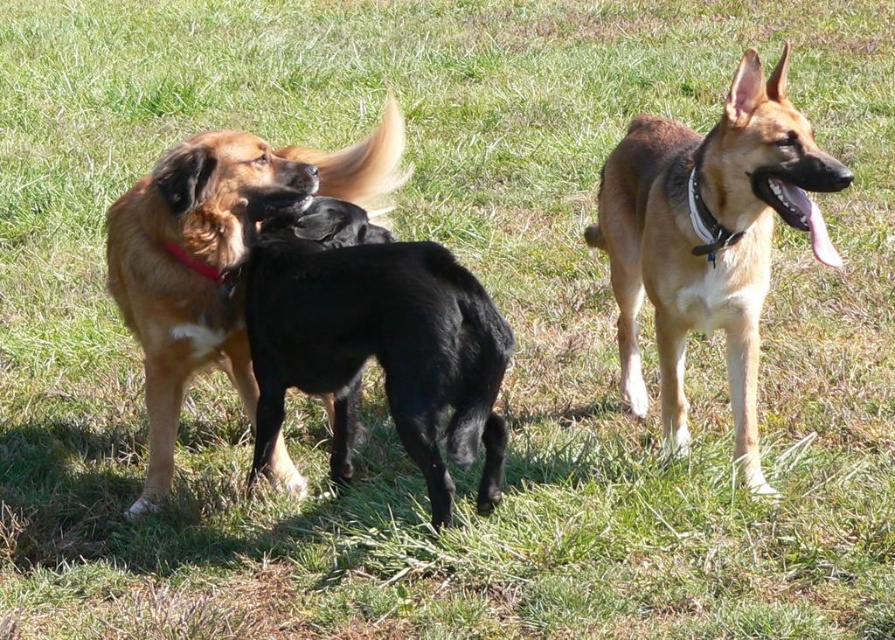
You are standing in the field and want to approach the black smooth dog at center and the brown fur dog at center. Which dog should you walk towards first if you want to reach the one on the left side first?

You should approach the brown fur dog at center first because it is on the left side of the black smooth dog at center, as the black smooth dog at center is to the right of the brown fur dog at center.

You are standing in the middle of the grassy field and see the golden fur dog at center and the brown fur dog at center. Which dog is positioned to the right side from your perspective?

The golden fur dog at center is positioned to the right of the brown fur dog at center, so the golden fur dog at center is on the right side from your perspective.